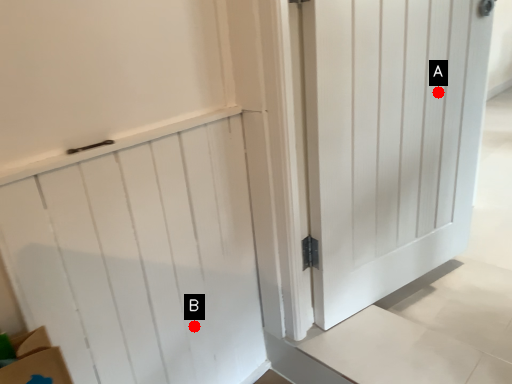
Question: Two points are circled on the image, labeled by A and B beside each circle. Which point appears closest to the camera in this image?

Choices:
 (A) A is closer
 (B) B is closer

Answer: (B)